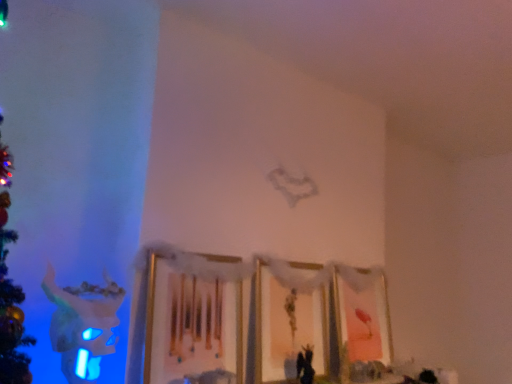
Question: Considering the relative positions of pink matte picture frame at lower right, the third picture frame from the left, and wooden picture frame at center, which is counted as the third picture frame, starting from the right, in the image provided, is pink matte picture frame at lower right, the third picture frame from the left, behind wooden picture frame at center, which is counted as the third picture frame, starting from the right,?

Choices:
 (A) no
 (B) yes

Answer: (B)

Question: Is pink matte picture frame at lower right, the third picture frame from the left, taller than wooden picture frame at center, which is counted as the third picture frame, starting from the right?

Choices:
 (A) no
 (B) yes

Answer: (B)

Question: Is pink matte picture frame at lower right, acting as the first picture frame starting from the right, facing towards wooden picture frame at center, placed as the first picture frame when sorted from left to right?

Choices:
 (A) no
 (B) yes

Answer: (A)

Question: From a real-world perspective, does pink matte picture frame at lower right, acting as the first picture frame starting from the right, stand above wooden picture frame at center, which is counted as the third picture frame, starting from the right?

Choices:
 (A) no
 (B) yes

Answer: (A)

Question: From a real-world perspective, does pink matte picture frame at lower right, acting as the first picture frame starting from the right, sit lower than wooden picture frame at center, placed as the first picture frame when sorted from left to right?

Choices:
 (A) no
 (B) yes

Answer: (B)

Question: From a real-world perspective, is pink matte picture frame at lower right, acting as the first picture frame starting from the right, above or below matte gold picture frame at center, the 2th picture frame when ordered from right to left?

Choices:
 (A) below
 (B) above

Answer: (A)

Question: Is point (381, 314) positioned closer to the camera than point (305, 273)?

Choices:
 (A) farther
 (B) closer

Answer: (A)

Question: Relative to matte gold picture frame at center, placed as the second picture frame when sorted from left to right, is pink matte picture frame at lower right, acting as the first picture frame starting from the right, in front or behind?

Choices:
 (A) front
 (B) behind

Answer: (B)

Question: Considering the positions of pink matte picture frame at lower right, acting as the first picture frame starting from the right, and matte gold picture frame at center, the 2th picture frame when ordered from right to left, in the image, is pink matte picture frame at lower right, acting as the first picture frame starting from the right, taller or shorter than matte gold picture frame at center, the 2th picture frame when ordered from right to left,?

Choices:
 (A) tall
 (B) short

Answer: (A)

Question: From their relative heights in the image, would you say wooden picture frame at center, which is counted as the third picture frame, starting from the right, is taller or shorter than matte gold picture frame at center, placed as the second picture frame when sorted from left to right?

Choices:
 (A) tall
 (B) short

Answer: (B)

Question: From the image's perspective, relative to matte gold picture frame at center, placed as the second picture frame when sorted from left to right, is wooden picture frame at center, which is counted as the third picture frame, starting from the right, above or below?

Choices:
 (A) below
 (B) above

Answer: (B)

Question: Considering the positions of wooden picture frame at center, placed as the first picture frame when sorted from left to right, and matte gold picture frame at center, placed as the second picture frame when sorted from left to right, in the image, is wooden picture frame at center, placed as the first picture frame when sorted from left to right, wider or thinner than matte gold picture frame at center, placed as the second picture frame when sorted from left to right,?

Choices:
 (A) thin
 (B) wide

Answer: (A)

Question: From a real-world perspective, is wooden picture frame at center, which is counted as the third picture frame, starting from the right, positioned above or below matte gold picture frame at center, the 2th picture frame when ordered from right to left?

Choices:
 (A) above
 (B) below

Answer: (A)

Question: In terms of width, does pink matte picture frame at lower right, the third picture frame from the left, look wider or thinner when compared to wooden picture frame at center, which is counted as the third picture frame, starting from the right?

Choices:
 (A) wide
 (B) thin

Answer: (A)

Question: Considering the positions of point click(x=376, y=317) and point click(x=229, y=261), is point click(x=376, y=317) closer or farther from the camera than point click(x=229, y=261)?

Choices:
 (A) farther
 (B) closer

Answer: (A)